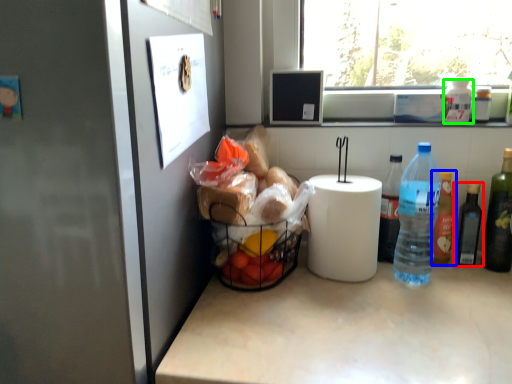
Question: Which object is positioned closest to bottle (highlighted by a red box)? Select from bottle (highlighted by a blue box) and bottle (highlighted by a green box).

Choices:
 (A) bottle
 (B) bottle

Answer: (A)